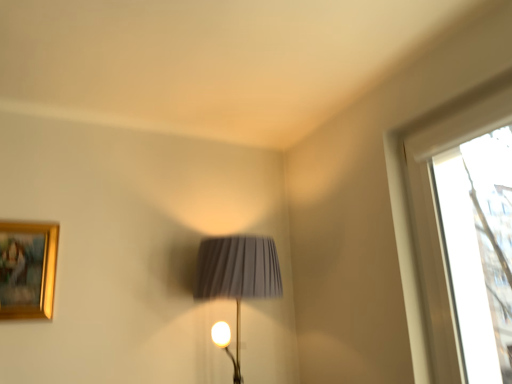
What is the approximate width of gold-framed painting at lower left?

gold-framed painting at lower left is 2.40 inches in width.

You are a GUI agent. You are given a task and a screenshot of the screen. Output one action in this format:
    pyautogui.click(x=<x>, y=<y>)
    Task: Click on the gold-framed painting at lower left
    
    Given the screenshot: What is the action you would take?
    pyautogui.click(x=27, y=269)

This screenshot has width=512, height=384. What do you see at coordinates (27, 269) in the screenshot?
I see `gold-framed painting at lower left` at bounding box center [27, 269].

Find the location of a particular element. The image size is (512, 384). gold-framed painting at lower left is located at coordinates (27, 269).